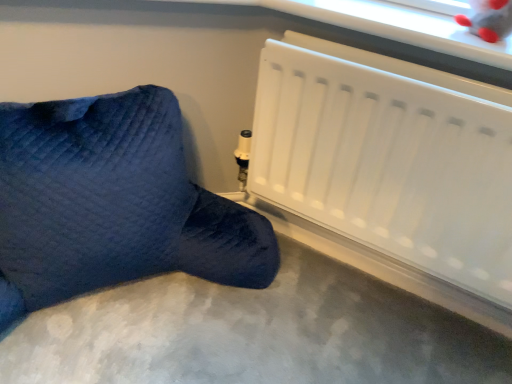
Locate an element on the screen. The height and width of the screenshot is (384, 512). free point below velvety blue bean bag at lower left (from a real-world perspective) is located at coordinates (139, 300).